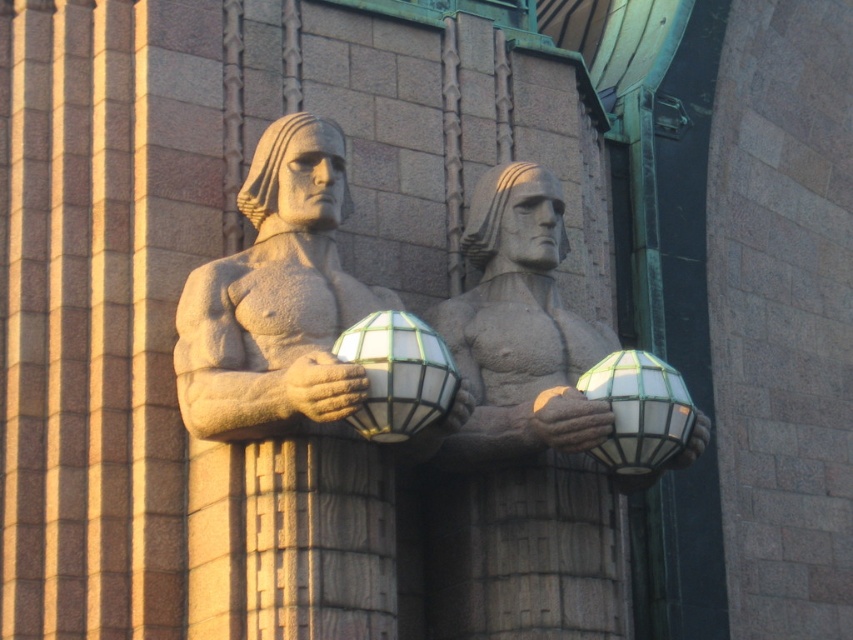
Question: Does sandy stone statue at center have a lesser width compared to translucent glass sphere at center?

Choices:
 (A) no
 (B) yes

Answer: (A)

Question: Can you confirm if stone statue at center is positioned below stained glass globe at center?

Choices:
 (A) no
 (B) yes

Answer: (A)

Question: Considering the real-world distances, which object is closest to the stone statue at center?

Choices:
 (A) smooth beige hand at center
 (B) smooth stone hand at center
 (C) stained glass globe at center
 (D) translucent glass sphere at center

Answer: (A)

Question: Among these objects, which one is farthest from the camera?

Choices:
 (A) smooth beige hand at center
 (B) stone statue at center
 (C) sandy stone statue at center

Answer: (A)

Question: Considering the real-world distances, which object is farthest from the stone statue at center?

Choices:
 (A) translucent glass sphere at center
 (B) smooth beige hand at center
 (C) stained glass globe at center
 (D) smooth stone hand at center

Answer: (D)

Question: Does stained glass globe at center appear under smooth beige hand at center?

Choices:
 (A) yes
 (B) no

Answer: (B)